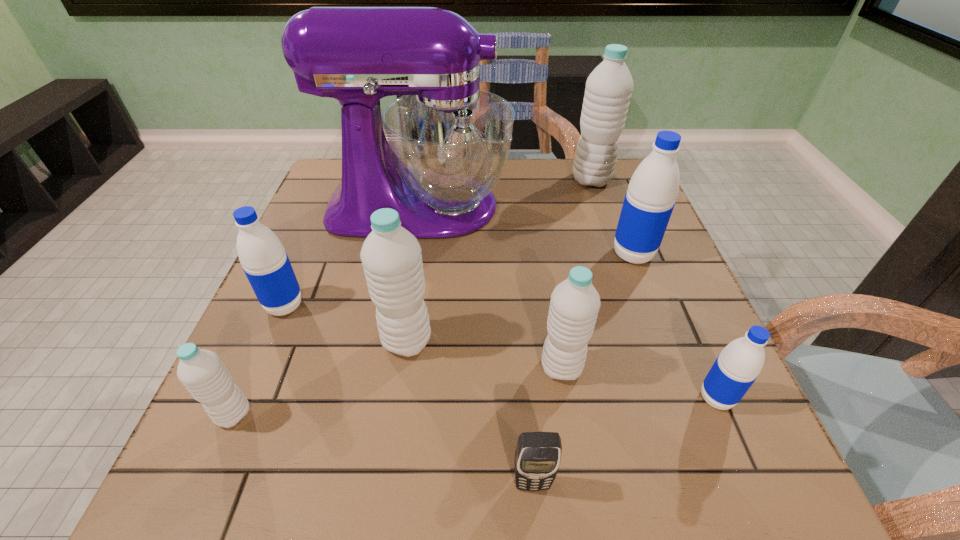
Where is `empty space between the mixer and the farthest blue water bottle`? The width and height of the screenshot is (960, 540). empty space between the mixer and the farthest blue water bottle is located at coordinates 526,231.

Locate an element on the screen. This screenshot has height=540, width=960. free space between the leftmost blue water bottle and the second white water bottle from left to right is located at coordinates (346, 323).

This screenshot has height=540, width=960. Find the location of `blank region between the fifth nearest water bottle and the third water bottle from left to right`. blank region between the fifth nearest water bottle and the third water bottle from left to right is located at coordinates tap(346, 323).

Point out which object is positioned as the third nearest to the smallest white water bottle. Please provide its 2D coordinates. Your answer should be formatted as a tuple, i.e. [(x, y)], where the tuple contains the x and y coordinates of a point satisfying the conditions above.

[(447, 143)]

The image size is (960, 540). In order to click on object that is the second nearest to the tallest object in this screenshot , I will do `click(608, 90)`.

Locate an element on the screen. The height and width of the screenshot is (540, 960). water bottle that is the closest one to the farthest blue water bottle is located at coordinates (608, 90).

Point out which water bottle is positioned as the fifth nearest to the biggest blue water bottle. Please provide its 2D coordinates. Your answer should be formatted as a tuple, i.e. [(x, y)], where the tuple contains the x and y coordinates of a point satisfying the conditions above.

[(266, 264)]

Select which white water bottle appears as the second closest to the sixth object from left to right. Please provide its 2D coordinates. Your answer should be formatted as a tuple, i.e. [(x, y)], where the tuple contains the x and y coordinates of a point satisfying the conditions above.

[(202, 372)]

At what (x,y) coordinates should I click in order to perform the action: click on the closest white water bottle to the leftmost white water bottle. Please return your answer as a coordinate pair (x, y). This screenshot has width=960, height=540. Looking at the image, I should click on (391, 256).

Point out which blue water bottle is positioned as the second nearest to the sixth nearest water bottle. Please provide its 2D coordinates. Your answer should be formatted as a tuple, i.e. [(x, y)], where the tuple contains the x and y coordinates of a point satisfying the conditions above.

[(266, 264)]